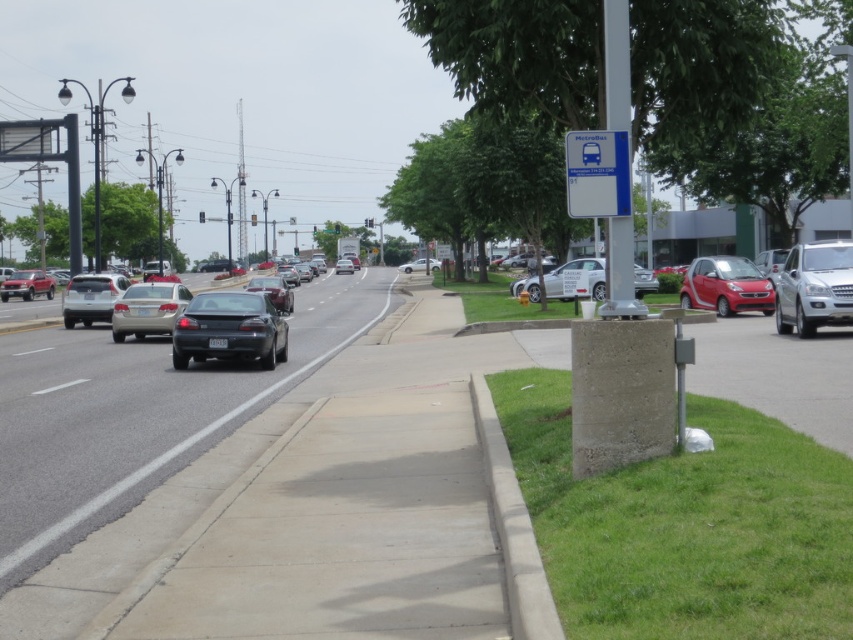
Which is in front, point (149, 449) or point (221, 308)?

Point (149, 449)

What do you see at coordinates (140, 416) in the screenshot? Image resolution: width=853 pixels, height=640 pixels. I see `gray concrete sidewalk at center` at bounding box center [140, 416].

At what (x,y) coordinates should I click in order to perform the action: click on gray concrete sidewalk at center. Please return your answer as a coordinate pair (x, y). Looking at the image, I should click on (140, 416).

From the picture: Does satin silver suv at right appear on the left side of blue plastic bus stop sign at upper right?

Incorrect, satin silver suv at right is not on the left side of blue plastic bus stop sign at upper right.

Between satin silver suv at right and blue plastic bus stop sign at upper right, which one has less height?

blue plastic bus stop sign at upper right

Does point (796, 321) come in front of point (628, 179)?

No, (796, 321) is behind (628, 179).

Where is `satin silver suv at right`? satin silver suv at right is located at coordinates (814, 288).

From the picture: Is gray concrete curb at lower right positioned in front of satin black sedan at center?

Yes, gray concrete curb at lower right is in front of satin black sedan at center.

Does gray concrete curb at lower right appear on the right side of satin black sedan at center?

Correct, you'll find gray concrete curb at lower right to the right of satin black sedan at center.

Find the location of a particular element. Image resolution: width=853 pixels, height=640 pixels. gray concrete curb at lower right is located at coordinates (512, 528).